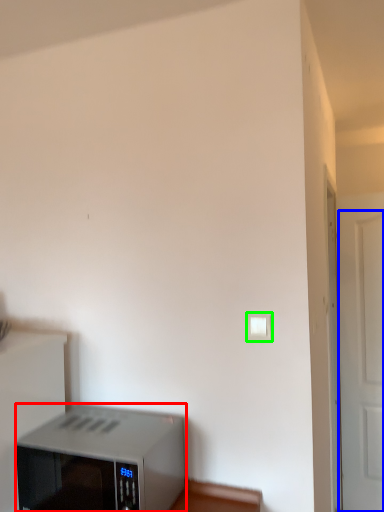
Question: Considering the real-world distances, which object is closest to home appliance (highlighted by a red box)? door (highlighted by a blue box) or light switch (highlighted by a green box).

Choices:
 (A) door
 (B) light switch

Answer: (B)